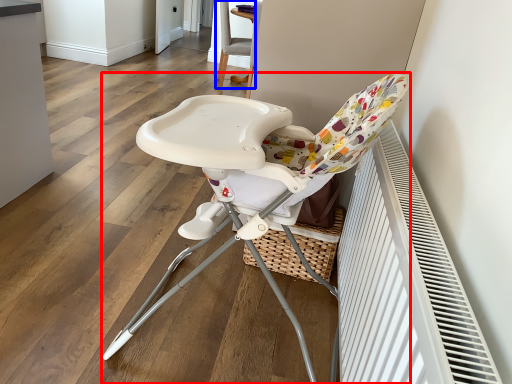
Question: Among these objects, which one is nearest to the camera, chair (highlighted by a red box) or chair (highlighted by a blue box)?

Choices:
 (A) chair
 (B) chair

Answer: (A)